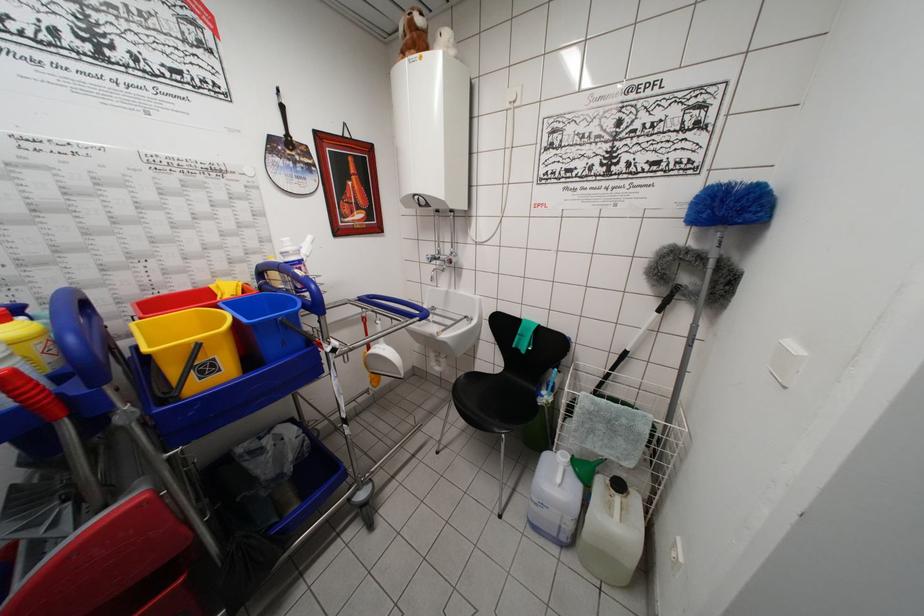
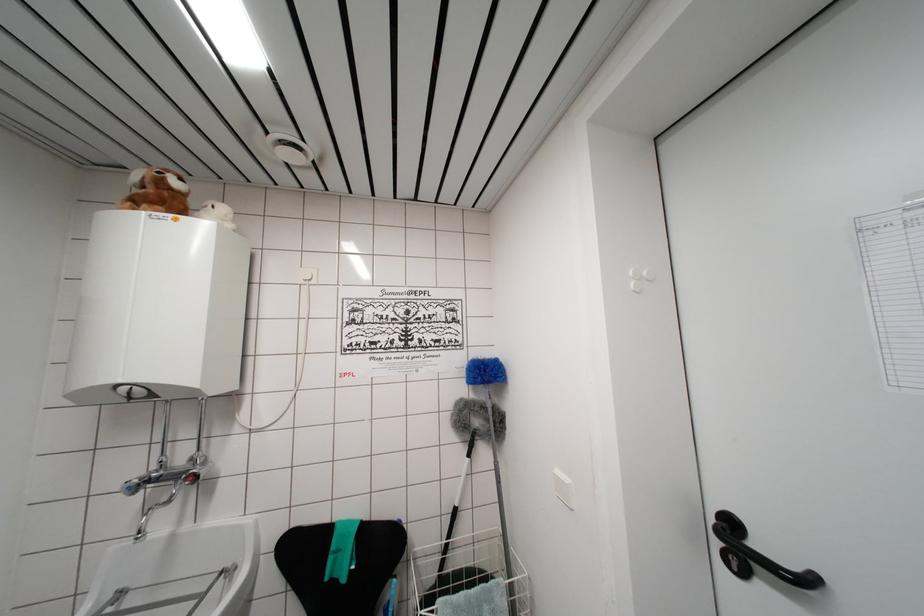
From the picture: The first image is from the beginning of the video and the second image is from the end. How did the camera likely rotate when shooting the video?

The rotation direction of the camera is right-up.